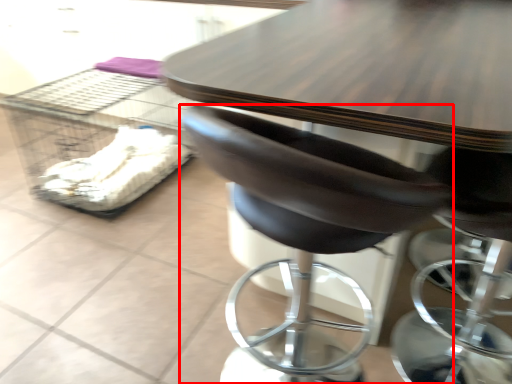
Question: In this image, where is chair (annotated by the red box) located relative to crate?

Choices:
 (A) right
 (B) left

Answer: (A)